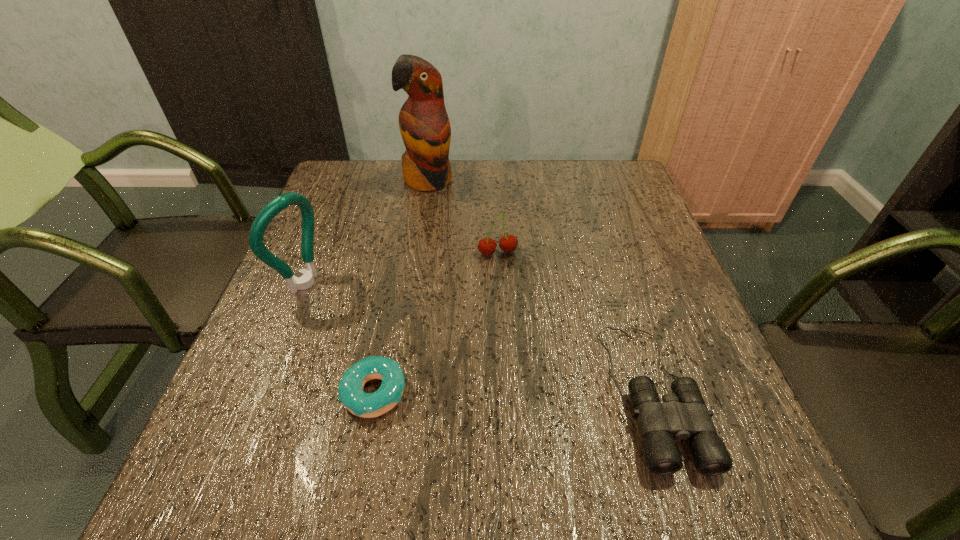
The height and width of the screenshot is (540, 960). I want to click on the shortest object, so click(x=350, y=389).

You are a GUI agent. You are given a task and a screenshot of the screen. Output one action in this format:
    pyautogui.click(x=<x>, y=<y>)
    Task: Click on the binoculars
    This screenshot has width=960, height=540.
    Given the screenshot: What is the action you would take?
    pyautogui.click(x=683, y=414)

What are the coordinates of `the second shortest object` in the screenshot? It's located at pyautogui.click(x=683, y=414).

Locate an element on the screen. The height and width of the screenshot is (540, 960). the third shortest object is located at coordinates (508, 243).

The image size is (960, 540). I want to click on cherry, so click(x=508, y=243).

Locate an element on the screen. Image resolution: width=960 pixels, height=540 pixels. the leftmost object is located at coordinates (281, 202).

This screenshot has height=540, width=960. In order to click on bottle opener in this screenshot , I will do `click(281, 202)`.

Where is `the farthest object`? This screenshot has height=540, width=960. the farthest object is located at coordinates (424, 125).

Image resolution: width=960 pixels, height=540 pixels. Find the location of `parrot`. parrot is located at coordinates (424, 125).

This screenshot has width=960, height=540. I want to click on free spot located 0.170m on the left of the doughnut, so click(x=249, y=392).